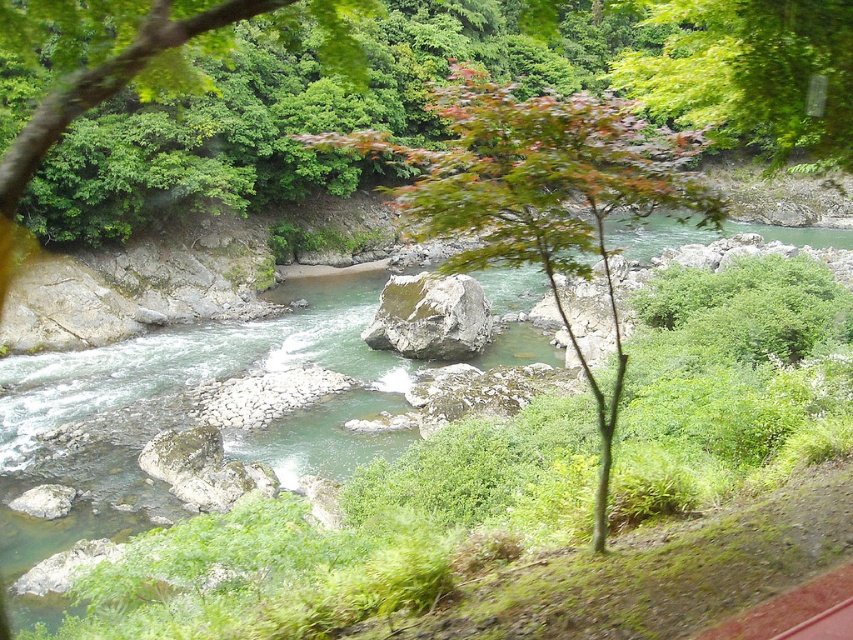
Who is lower down, green leafy tree at center or green leafy tree at upper center?

Positioned lower is green leafy tree at center.

Is point (519, 186) in front of point (784, 54)?

Yes, point (519, 186) is in front of point (784, 54).

I want to click on green leafy tree at center, so click(543, 195).

Which of these two, green leafy tree at upper center or gray/rough rock at center, stands taller?

With more height is green leafy tree at upper center.

Based on the photo, does green leafy tree at upper center lie in front of gray/rough rock at center?

Yes, green leafy tree at upper center is in front of gray/rough rock at center.

Between point (646, 70) and point (375, 340), which one is positioned behind?

Positioned behind is point (375, 340).

Locate an element on the screen. green leafy tree at upper center is located at coordinates (751, 74).

Can you confirm if green leafy tree at center is positioned to the left of gray/rough rock at center?

No, green leafy tree at center is not to the left of gray/rough rock at center.

Measure the distance from green leafy tree at center to gray/rough rock at center.

A distance of 9.36 meters exists between green leafy tree at center and gray/rough rock at center.

Who is more forward, (515, 113) or (425, 332)?

Positioned in front is point (515, 113).

At what (x,y) coordinates should I click in order to perform the action: click on green leafy tree at center. Please return your answer as a coordinate pair (x, y). Looking at the image, I should click on (543, 195).